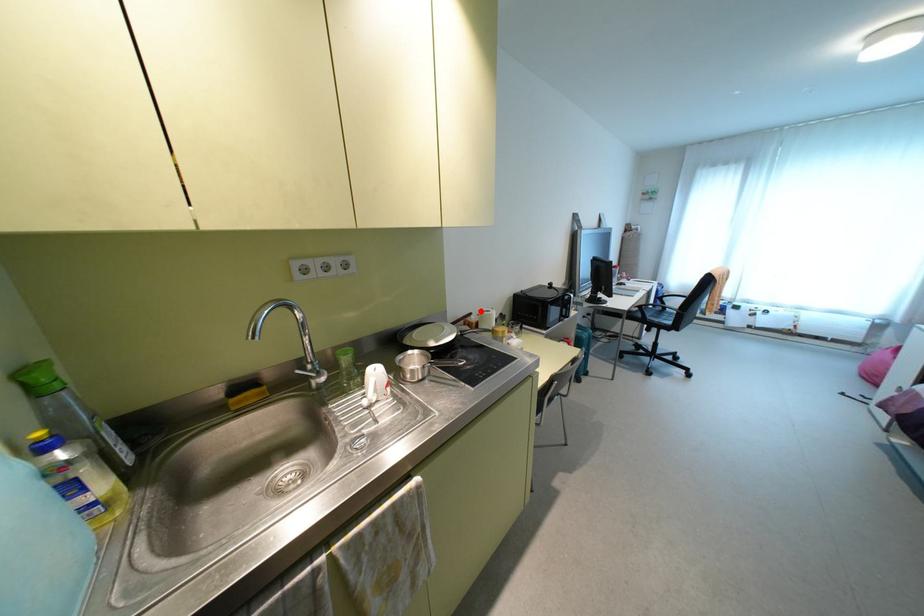
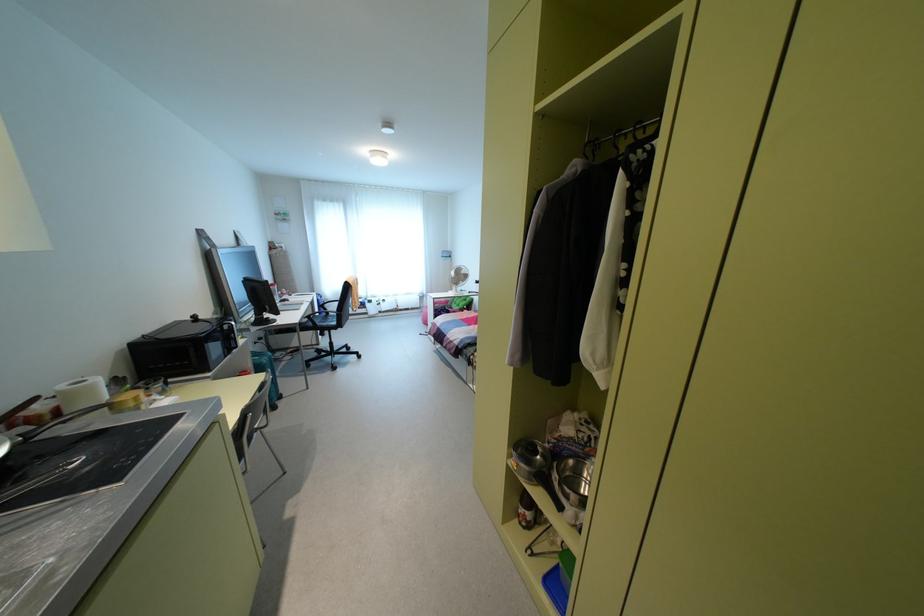
Locate, in the second image, the point that corresponds to the highlighted location in the first image.

(62, 387)